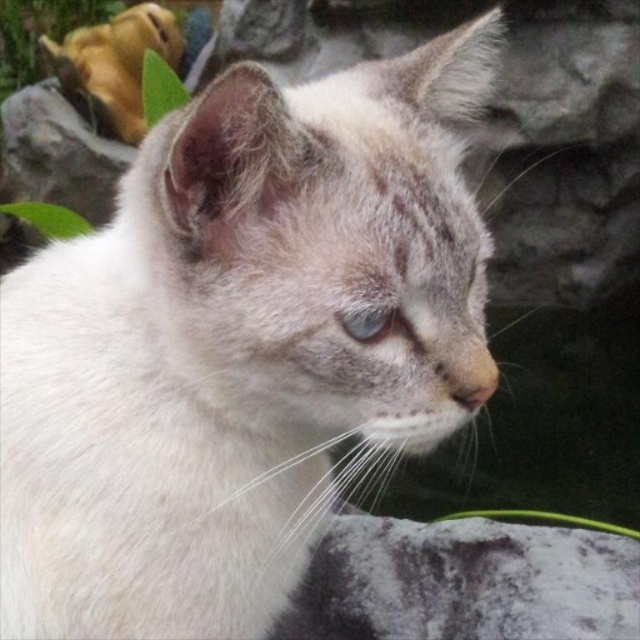
Is point (358, 557) more distant than point (385, 310)?

That is True.

Is fuzzy gray stone at lower right above blue glossy eye at center?

Actually, fuzzy gray stone at lower right is below blue glossy eye at center.

This screenshot has width=640, height=640. Describe the element at coordinates (465, 582) in the screenshot. I see `fuzzy gray stone at lower right` at that location.

You are a GUI agent. You are given a task and a screenshot of the screen. Output one action in this format:
    pyautogui.click(x=<x>, y=<y>)
    Task: Click on the fuzzy gray stone at lower right
    
    Given the screenshot: What is the action you would take?
    pyautogui.click(x=465, y=582)